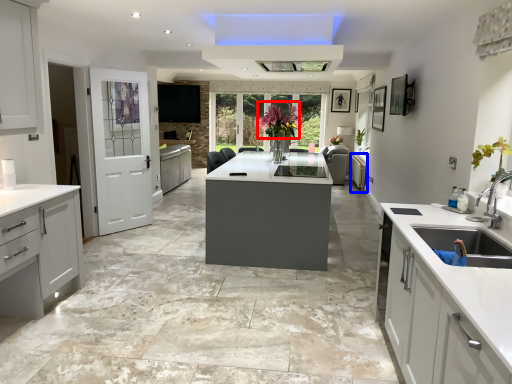
Question: Among these objects, which one is farthest to the camera, floral arrangement (highlighted by a red box) or cabinetry (highlighted by a blue box)?

Choices:
 (A) floral arrangement
 (B) cabinetry

Answer: (B)